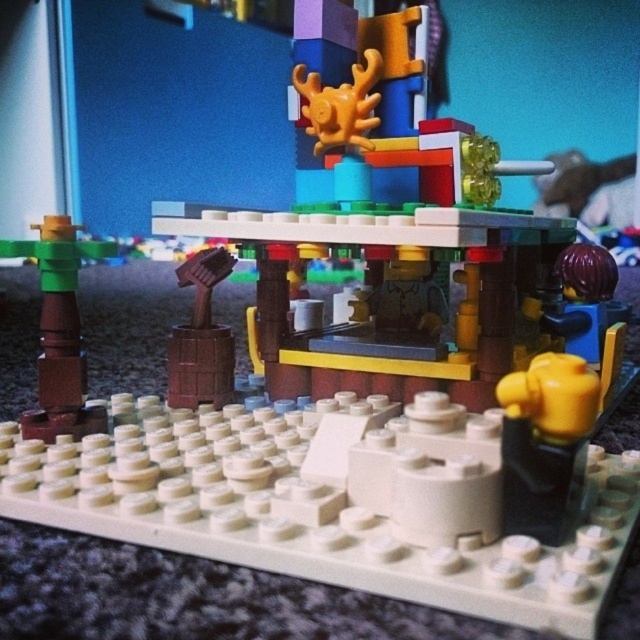
Between point (65, 416) and point (227, 337), which one is positioned behind?

The point (227, 337) is more distant.

Is point (65, 330) farther from viewer compared to point (211, 385)?

No, it is not.

I want to click on brown matte post at left, so click(60, 330).